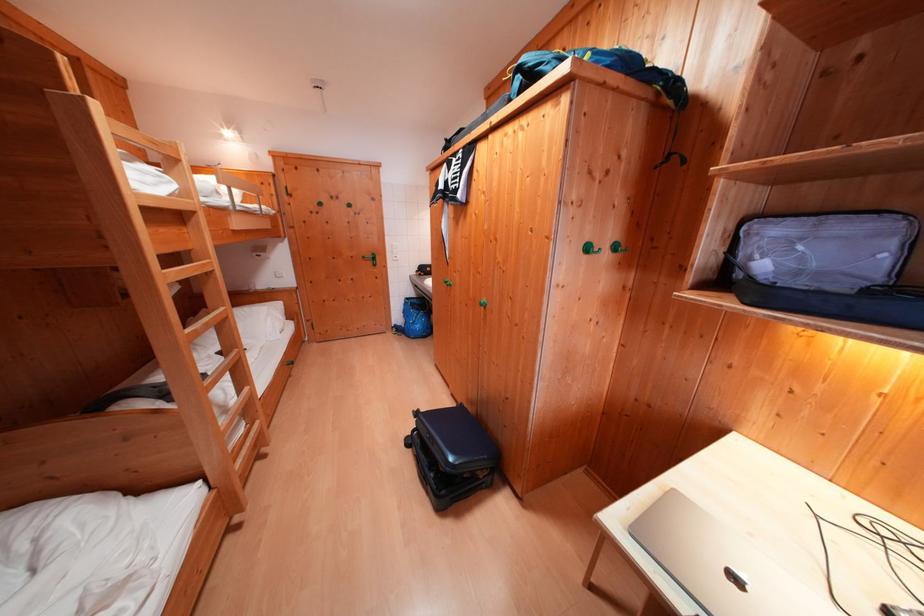
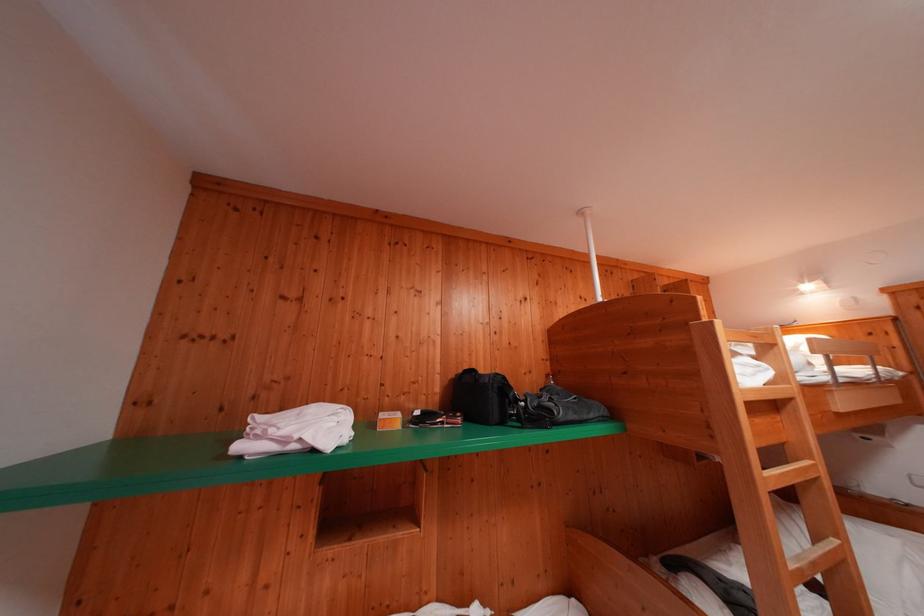
Question: I am providing you with two images of the same scene from different viewpoints. Which of the following objects are not visible in image2?

Choices:
 (A) chair sitting surface
 (B) black camera bag
 (C) small orange box
 (D) none of these

Answer: (D)